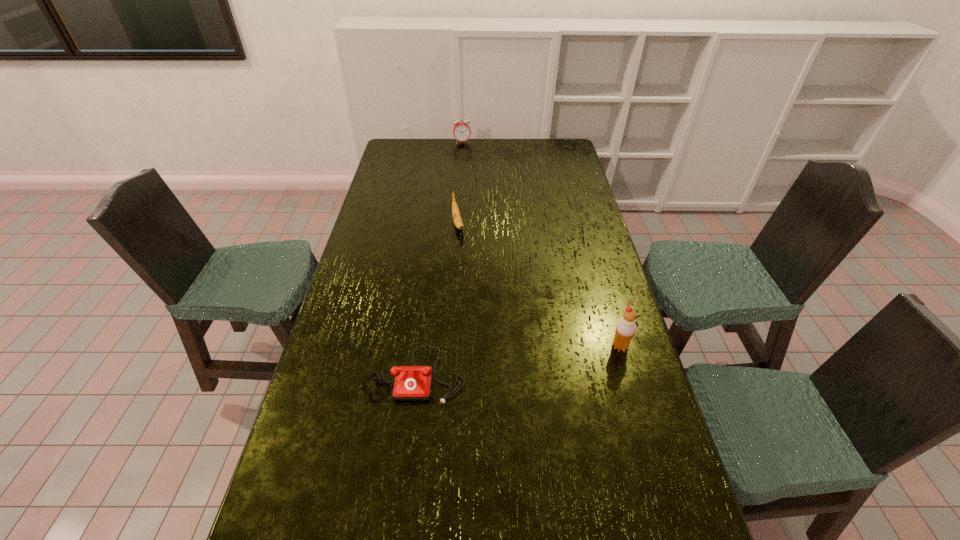
Find the location of a particular element. The image size is (960, 540). vacant space situated on the peel of the banana from the top is located at coordinates (462, 248).

You are a GUI agent. You are given a task and a screenshot of the screen. Output one action in this format:
    pyautogui.click(x=<x>, y=<y>)
    Task: Click on the vacant space located on the front-facing side of the farthest object
    The height and width of the screenshot is (540, 960).
    Given the screenshot: What is the action you would take?
    pyautogui.click(x=467, y=158)

This screenshot has width=960, height=540. Find the location of `vacant space positioned 0.400m on the front-facing side of the farthest object`. vacant space positioned 0.400m on the front-facing side of the farthest object is located at coordinates (473, 186).

This screenshot has height=540, width=960. I want to click on free point located on the front-facing side of the farthest object, so click(469, 170).

Locate an element on the screen. object at the far edge is located at coordinates (461, 130).

Identify the location of object positioned at the left edge. (412, 383).

The width and height of the screenshot is (960, 540). Identify the location of object that is at the right edge. (625, 329).

You are a GUI agent. You are given a task and a screenshot of the screen. Output one action in this format:
    pyautogui.click(x=<x>, y=<y>)
    Task: Click on the vacant space at the far edge of the desktop
    Image resolution: width=960 pixels, height=540 pixels.
    Given the screenshot: What is the action you would take?
    coord(469,148)

The height and width of the screenshot is (540, 960). Identify the location of vacant space at the near edge. (429, 490).

Image resolution: width=960 pixels, height=540 pixels. In order to click on free region at the left edge of the desktop in this screenshot , I will do `click(391, 250)`.